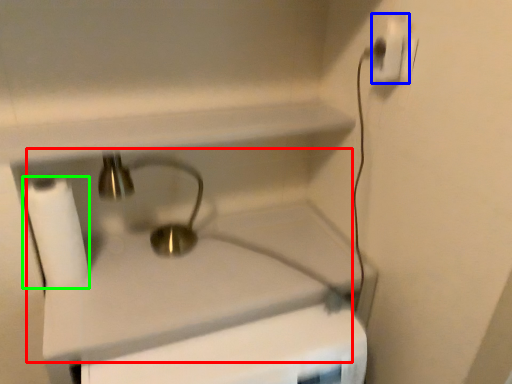
Question: Based on their relative distances, which object is farther from sink (highlighted by a red box)? Choose from power plugs and sockets (highlighted by a blue box) and toilet paper (highlighted by a green box).

Choices:
 (A) power plugs and sockets
 (B) toilet paper

Answer: (A)